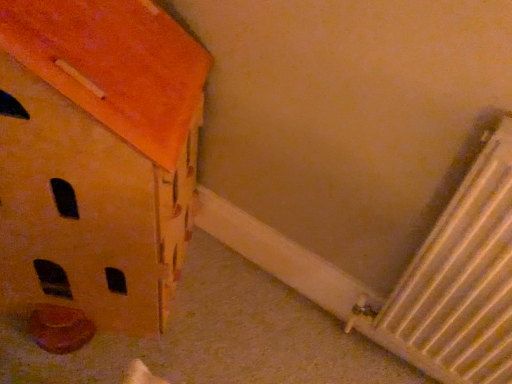
Describe the element at coordinates (458, 281) in the screenshot. This screenshot has height=384, width=512. I see `white metallic radiator at lower right` at that location.

In order to face white metallic radiator at lower right, should I rotate leftwards or rightwards?

To align with it, rotate right about 28.075°.

Identify the location of white metallic radiator at lower right. (458, 281).

Where is `matte orange cardboard box at lower left`? matte orange cardboard box at lower left is located at coordinates (96, 157).

What do you see at coordinates (96, 157) in the screenshot? I see `matte orange cardboard box at lower left` at bounding box center [96, 157].

Where is `white metallic radiator at lower right`? The image size is (512, 384). white metallic radiator at lower right is located at coordinates (458, 281).

Is matte orange cardboard box at lower left to the left or to the right of white metallic radiator at lower right in the image?

From the image, it's evident that matte orange cardboard box at lower left is to the left of white metallic radiator at lower right.

Is matte orange cardboard box at lower left in front of or behind white metallic radiator at lower right in the image?

matte orange cardboard box at lower left is positioned closer to the viewer than white metallic radiator at lower right.

Considering the positions of points (36, 54) and (404, 281), is point (36, 54) closer to camera compared to point (404, 281)?

That is True.

From the image's perspective, is matte orange cardboard box at lower left above white metallic radiator at lower right?

Yes.

From a real-world perspective, who is located lower, matte orange cardboard box at lower left or white metallic radiator at lower right?

In real-world perspective, matte orange cardboard box at lower left is lower.

Which of these two, matte orange cardboard box at lower left or white metallic radiator at lower right, is wider?

matte orange cardboard box at lower left.

From their relative heights in the image, would you say matte orange cardboard box at lower left is taller or shorter than white metallic radiator at lower right?

Clearly, matte orange cardboard box at lower left is taller compared to white metallic radiator at lower right.

Which of these two, matte orange cardboard box at lower left or white metallic radiator at lower right, is bigger?

matte orange cardboard box at lower left.

Is white metallic radiator at lower right a part of matte orange cardboard box at lower left?

Actually, white metallic radiator at lower right is outside matte orange cardboard box at lower left.

Is the surface of matte orange cardboard box at lower left in direct contact with white metallic radiator at lower right?

matte orange cardboard box at lower left and white metallic radiator at lower right are not in contact.

Is matte orange cardboard box at lower left oriented towards white metallic radiator at lower right?

No, matte orange cardboard box at lower left is not turned towards white metallic radiator at lower right.

How different are the orientations of matte orange cardboard box at lower left and white metallic radiator at lower right in degrees?

They differ by 34.5 degrees in their facing directions.

How far apart are matte orange cardboard box at lower left and white metallic radiator at lower right?

The distance of matte orange cardboard box at lower left from white metallic radiator at lower right is 61.19 centimeters.

Locate an element on the screen. radiator below the matte orange cardboard box at lower left (from the image's perspective) is located at coordinates (458, 281).

Considering the relative positions of white metallic radiator at lower right and matte orange cardboard box at lower left in the image provided, is white metallic radiator at lower right to the right of matte orange cardboard box at lower left from the viewer's perspective?

Yes.

Which object is closer to the camera taking this photo, white metallic radiator at lower right or matte orange cardboard box at lower left?

matte orange cardboard box at lower left is more forward.

Which is less distant, (487, 345) or (60, 233)?

Point (487, 345) is positioned farther from the camera compared to point (60, 233).

From the image's perspective, between white metallic radiator at lower right and matte orange cardboard box at lower left, which one is located above?

matte orange cardboard box at lower left appears higher in the image.

From a real-world perspective, relative to matte orange cardboard box at lower left, is white metallic radiator at lower right vertically above or below?

In terms of real-world spatial position, white metallic radiator at lower right is above matte orange cardboard box at lower left.

Is white metallic radiator at lower right wider or thinner than matte orange cardboard box at lower left?

Considering their sizes, white metallic radiator at lower right looks slimmer than matte orange cardboard box at lower left.

Between white metallic radiator at lower right and matte orange cardboard box at lower left, which one has less height?

Standing shorter between the two is white metallic radiator at lower right.

Looking at this image, considering the sizes of objects white metallic radiator at lower right and matte orange cardboard box at lower left in the image provided, who is smaller, white metallic radiator at lower right or matte orange cardboard box at lower left?

Smaller between the two is white metallic radiator at lower right.

Is white metallic radiator at lower right situated inside matte orange cardboard box at lower left or outside?

white metallic radiator at lower right is located beyond the bounds of matte orange cardboard box at lower left.

Are white metallic radiator at lower right and matte orange cardboard box at lower left located far from each other?

Actually, white metallic radiator at lower right and matte orange cardboard box at lower left are a little close together.

Is white metallic radiator at lower right oriented towards matte orange cardboard box at lower left?

No, white metallic radiator at lower right is not oriented towards matte orange cardboard box at lower left.

How many degrees apart are the facing directions of white metallic radiator at lower right and matte orange cardboard box at lower left?

34.5 degrees.

Locate an element on the screen. This screenshot has width=512, height=384. radiator above the matte orange cardboard box at lower left (from a real-world perspective) is located at coordinates (458, 281).

Find the location of a particular element. The height and width of the screenshot is (384, 512). radiator behind the matte orange cardboard box at lower left is located at coordinates (458, 281).

I want to click on cardboard box directly beneath the white metallic radiator at lower right (from a real-world perspective), so click(x=96, y=157).